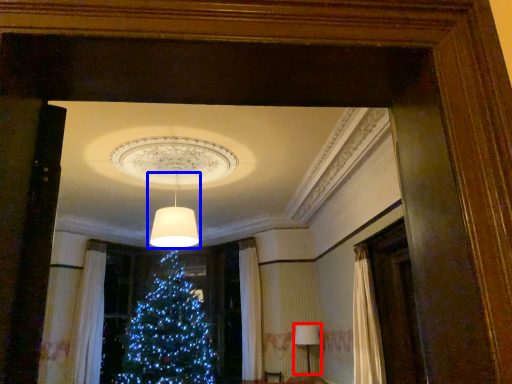
Question: Which object is further to the camera taking this photo, lamp (highlighted by a red box) or lamp (highlighted by a blue box)?

Choices:
 (A) lamp
 (B) lamp

Answer: (A)